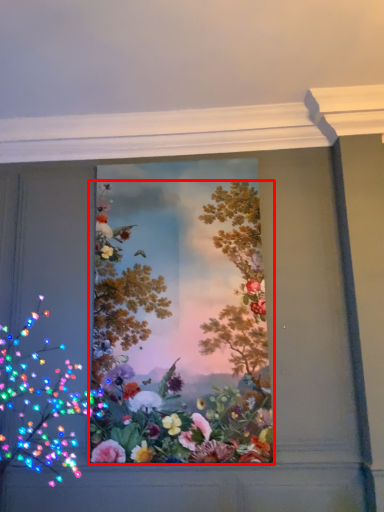
Question: From the image, what is the correct spatial relationship of flower (annotated by the red box) in relation to flower?

Choices:
 (A) left
 (B) right

Answer: (B)